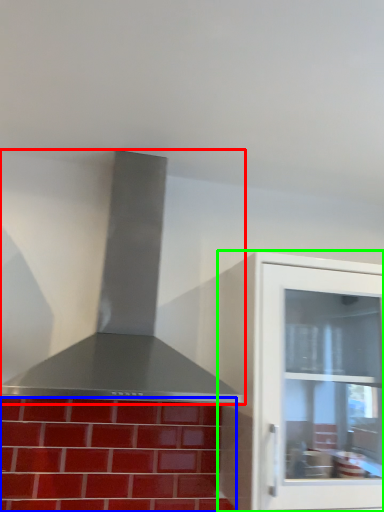
Question: Which object is the farthest from vent (highlighted by a red box)? Choose among these: brickwork (highlighted by a blue box) or cabinetry (highlighted by a green box).

Choices:
 (A) brickwork
 (B) cabinetry

Answer: (B)